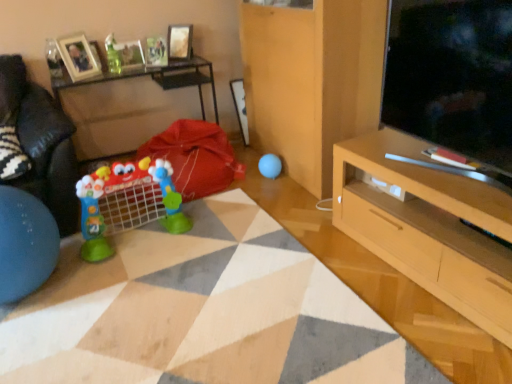
At what (x,y) coordinates should I click in order to perform the action: click on free space to the left of blue rubber ball at center, which is the first toy in back-to-front order. Please return your answer as a coordinate pair (x, y). Looking at the image, I should click on (247, 180).